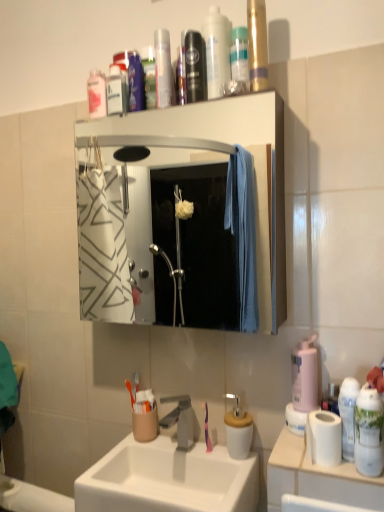
Question: Does white plastic cup at right turn towards white ceramic sink at center?

Choices:
 (A) yes
 (B) no

Answer: (B)

Question: Is white plastic cup at right smaller than white ceramic sink at center?

Choices:
 (A) no
 (B) yes

Answer: (B)

Question: Is white plastic cup at right oriented away from white ceramic sink at center?

Choices:
 (A) yes
 (B) no

Answer: (B)

Question: Is white plastic cup at right not inside white ceramic sink at center?

Choices:
 (A) yes
 (B) no

Answer: (A)

Question: From the image's perspective, is white plastic cup at right above white ceramic sink at center?

Choices:
 (A) yes
 (B) no

Answer: (A)

Question: Is white plastic cup at right beside white ceramic sink at center?

Choices:
 (A) yes
 (B) no

Answer: (B)

Question: Is pink matte bottle at right, the second cleaning product when ordered from front to back, turned away from purple glossy toothbrush at sink?

Choices:
 (A) no
 (B) yes

Answer: (A)

Question: Does pink matte bottle at right, which appears as the second cleaning product when viewed from the top, have a larger size compared to purple glossy toothbrush at sink?

Choices:
 (A) yes
 (B) no

Answer: (A)

Question: Does pink matte bottle at right, marked as the 2th cleaning product in a right-to-left arrangement, have a lesser height compared to purple glossy toothbrush at sink?

Choices:
 (A) no
 (B) yes

Answer: (A)

Question: From the image's perspective, does pink matte bottle at right, the second cleaning product when ordered from front to back, appear lower than purple glossy toothbrush at sink?

Choices:
 (A) yes
 (B) no

Answer: (B)

Question: Is pink matte bottle at right, the second cleaning product when ordered from front to back, further to camera compared to purple glossy toothbrush at sink?

Choices:
 (A) yes
 (B) no

Answer: (B)

Question: Considering the relative sizes of pink matte bottle at right, marked as the 2th cleaning product in a right-to-left arrangement, and purple glossy toothbrush at sink in the image provided, is pink matte bottle at right, marked as the 2th cleaning product in a right-to-left arrangement, wider than purple glossy toothbrush at sink?

Choices:
 (A) no
 (B) yes

Answer: (B)

Question: Would you say white ceramic sink at center contains transparent plastic bottle at upper center, the second mouthwash positioned from the back?

Choices:
 (A) no
 (B) yes

Answer: (A)